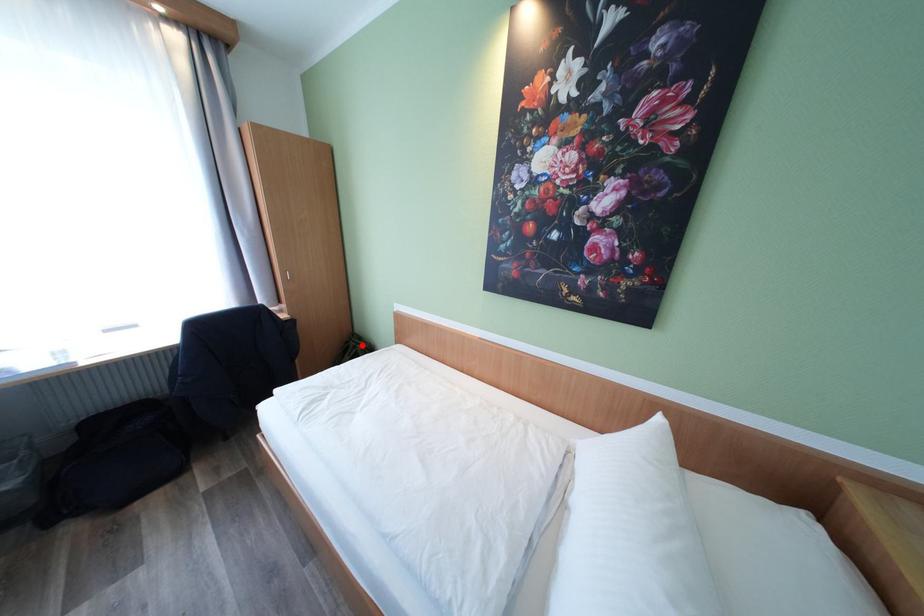
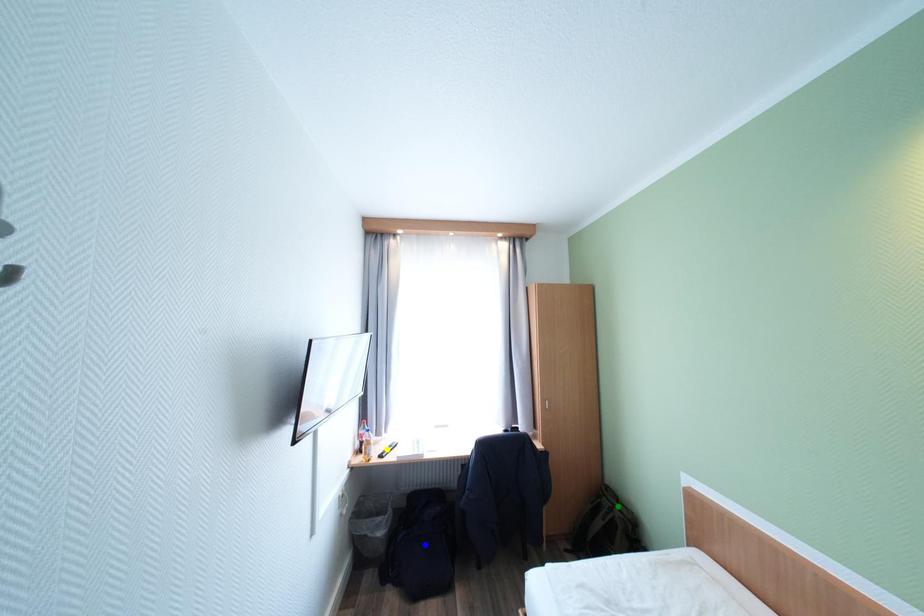
Question: I am providing you with two images of the same scene from different viewpoints. A red point is marked on the first image. You are given multiple points on the second image. Which mark in image 2 goes with the point in image 1?

Choices:
 (A) green point
 (B) blue point
 (C) yellow point

Answer: (A)